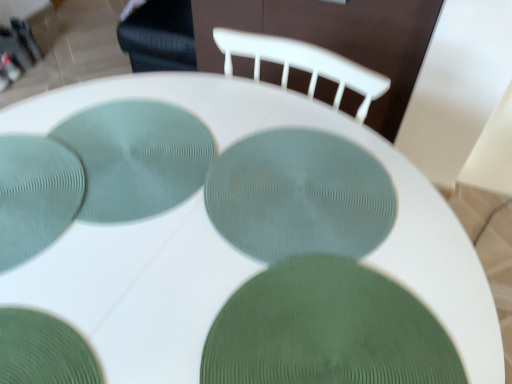
Locate an element on the screen. The height and width of the screenshot is (384, 512). vacant area on top of green textured plate at center, the 5th glass plate positioned from the left (from a real-world perspective) is located at coordinates (334, 329).